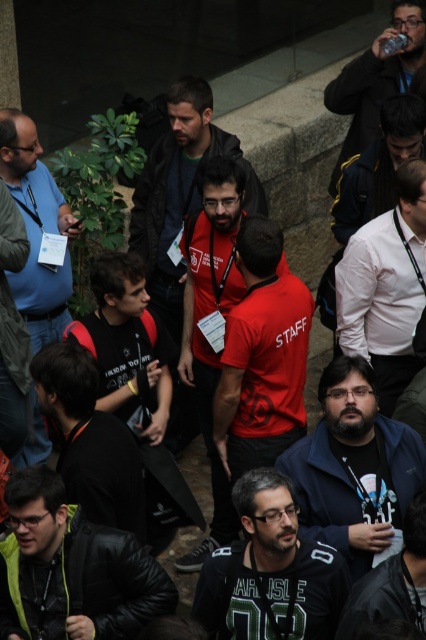
You are standing at the center of the image and want to locate the black leather jacket at lower left. Based on the coordinates given, in which direction should you look to find it?

The black leather jacket at lower left is located at coordinates point [71,570]. Since you are at the center, you should look to the lower left direction to find it.

You are standing at the top of the stone steps and want to locate the two jackets mentioned. Which jacket is closer to you, the black leather jacket at lower left or the black matte jacket at center?

The black leather jacket at lower left is positioned under the black matte jacket at center, so the black matte jacket at center is closer to you.

Consider the image. You are standing at the back of the group and want to see the person wearing the matte black shirt at center. Is the dark blue jacket at center blocking your view?

The dark blue jacket at center is positioned under the matte black shirt at center, so it is not blocking your view. You can see the matte black shirt at center above the dark blue jacket at center.